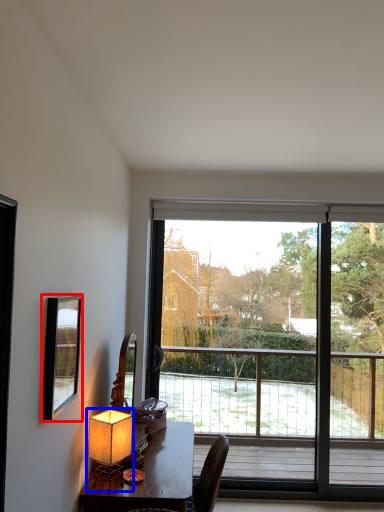
Question: Among these objects, which one is nearest to the camera, mirror (highlighted by a red box) or table lamp (highlighted by a blue box)?

Choices:
 (A) mirror
 (B) table lamp

Answer: (A)